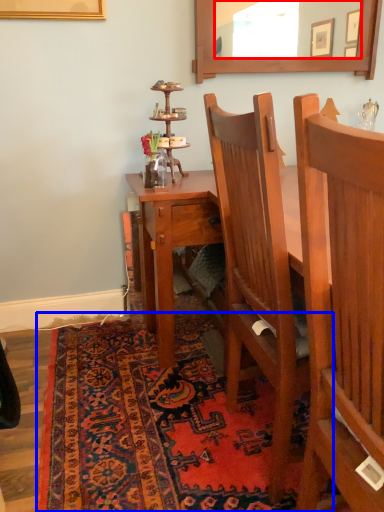
Question: Which object appears farthest to the camera in this image, mirror (highlighted by a red box) or mat (highlighted by a blue box)?

Choices:
 (A) mirror
 (B) mat

Answer: (A)